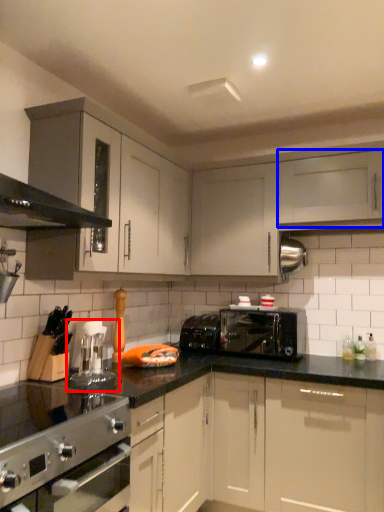
Question: Which object is closer to the camera taking this photo, coffee machine (highlighted by a red box) or cabinetry (highlighted by a blue box)?

Choices:
 (A) coffee machine
 (B) cabinetry

Answer: (A)